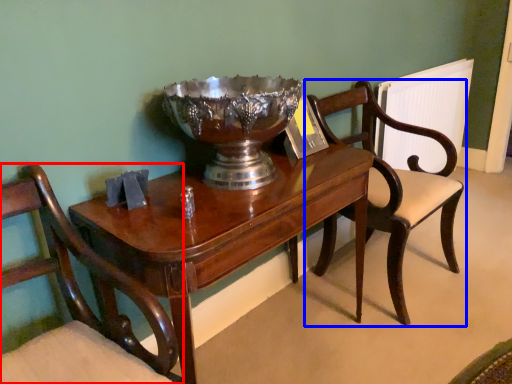
Question: Which point is closer to the camera, chair (highlighted by a red box) or chair (highlighted by a blue box)?

Choices:
 (A) chair
 (B) chair

Answer: (A)